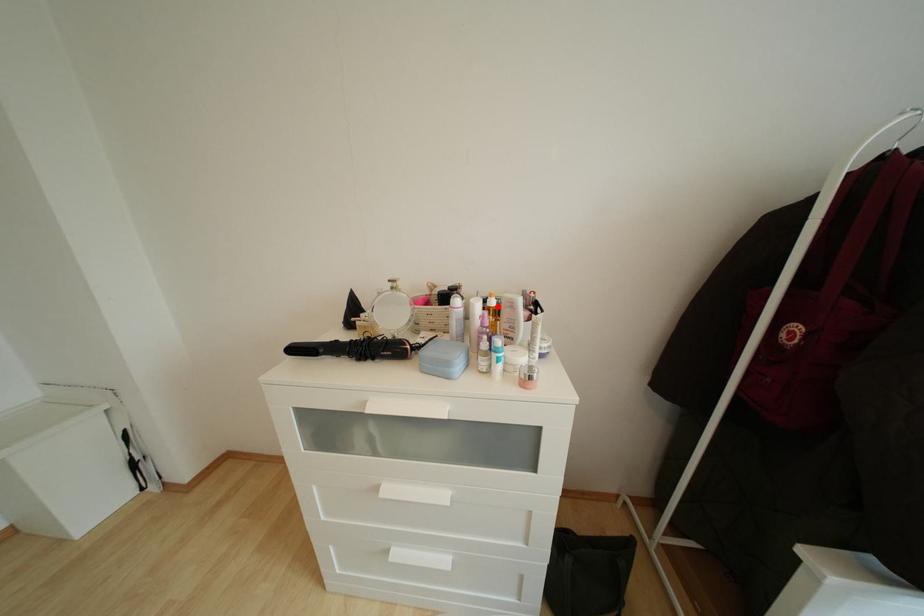
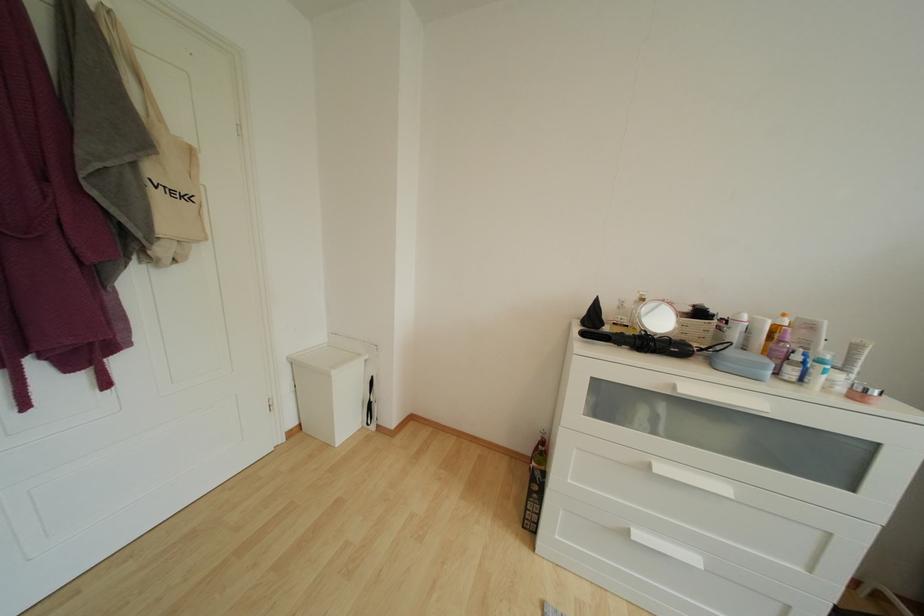
Locate, in the second image, the point that corresponds to the highlighted location in the first image.

(789, 326)